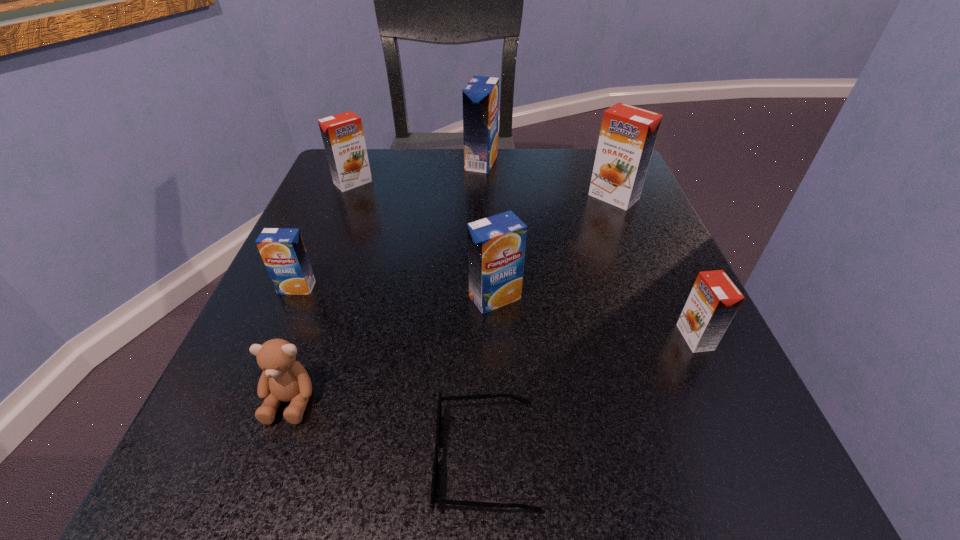
The height and width of the screenshot is (540, 960). Identify the location of empty space that is in between the biggest blue orange_juice and the nearest orange orange juice. (588, 250).

At what (x,y) coordinates should I click in order to perform the action: click on free space between the second biggest orange orange juice and the shortest object. Please return your answer as a coordinate pair (x, y). Image resolution: width=960 pixels, height=540 pixels. Looking at the image, I should click on (420, 320).

The image size is (960, 540). Identify the location of free spot between the biggest orange orange juice and the second biggest blue orange_juice. (554, 247).

Identify the location of unoccupied position between the biggest blue orange_juice and the leftmost blue orange_juice. The height and width of the screenshot is (540, 960). (389, 225).

In order to click on vacant space in between the leftmost blue orange_juice and the biggest blue orange_juice in this screenshot , I will do `click(389, 225)`.

Identify the location of free space between the leftmost orange orange juice and the biggest orange orange juice. The height and width of the screenshot is (540, 960). (484, 190).

Image resolution: width=960 pixels, height=540 pixels. In order to click on unoccupied area between the shortest object and the nearest orange juice in this screenshot , I will do `click(590, 397)`.

Locate an element on the screen. The image size is (960, 540). the fourth closest object to the biggest orange orange juice is located at coordinates (342, 134).

Locate which object ranks sixth in proximity to the second smallest blue orange_juice. Please provide its 2D coordinates. Your answer should be formatted as a tuple, i.e. [(x, y)], where the tuple contains the x and y coordinates of a point satisfying the conditions above.

[(342, 134)]

Identify the location of orange juice object that ranks as the second closest to the nearest orange orange juice. The height and width of the screenshot is (540, 960). (628, 134).